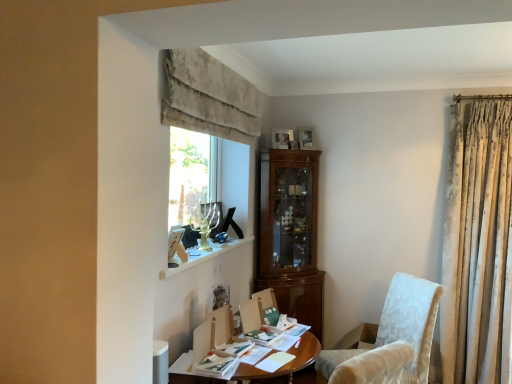
Question: From a real-world perspective, is wooden photo frame at upper center, which is the second picture frame in back-to-front order, below wooden desk at center?

Choices:
 (A) no
 (B) yes

Answer: (A)

Question: Is wooden photo frame at upper center, which is the second picture frame in back-to-front order, smaller than wooden desk at center?

Choices:
 (A) no
 (B) yes

Answer: (B)

Question: Would you consider wooden photo frame at upper center, arranged as the 1th picture frame when viewed from the front, to be distant from wooden desk at center?

Choices:
 (A) yes
 (B) no

Answer: (A)

Question: Does wooden photo frame at upper center, acting as the 2th picture frame starting from the right, appear on the left side of wooden desk at center?

Choices:
 (A) yes
 (B) no

Answer: (B)

Question: Does wooden photo frame at upper center, placed as the 1th picture frame when sorted from left to right, contain wooden desk at center?

Choices:
 (A) yes
 (B) no

Answer: (B)

Question: Does wooden photo frame at upper center, arranged as the 1th picture frame when viewed from the front, turn towards wooden desk at center?

Choices:
 (A) no
 (B) yes

Answer: (A)

Question: Could you tell me if white marble window sill at upper center is facing white textured fabric chair at lower right?

Choices:
 (A) no
 (B) yes

Answer: (A)

Question: Does white marble window sill at upper center lie behind white textured fabric chair at lower right?

Choices:
 (A) yes
 (B) no

Answer: (B)

Question: Does white marble window sill at upper center have a greater height compared to white textured fabric chair at lower right?

Choices:
 (A) no
 (B) yes

Answer: (A)

Question: From the image's perspective, is white marble window sill at upper center on top of white textured fabric chair at lower right?

Choices:
 (A) yes
 (B) no

Answer: (A)

Question: Is white marble window sill at upper center shorter than white textured fabric chair at lower right?

Choices:
 (A) yes
 (B) no

Answer: (A)

Question: Is white textured fabric chair at lower right at the back of white marble window sill at upper center?

Choices:
 (A) yes
 (B) no

Answer: (B)

Question: From a real-world perspective, is wooden photo frame at upper center, acting as the 2th picture frame starting from the right, on white textured fabric chair at lower right?

Choices:
 (A) no
 (B) yes

Answer: (B)